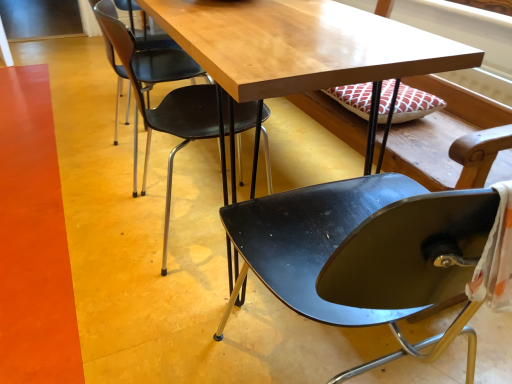
Where is `free space between wooden table at center and black plastic chair at upper center, acting as the 1th chair starting from the left`? This screenshot has width=512, height=384. free space between wooden table at center and black plastic chair at upper center, acting as the 1th chair starting from the left is located at coordinates (151, 188).